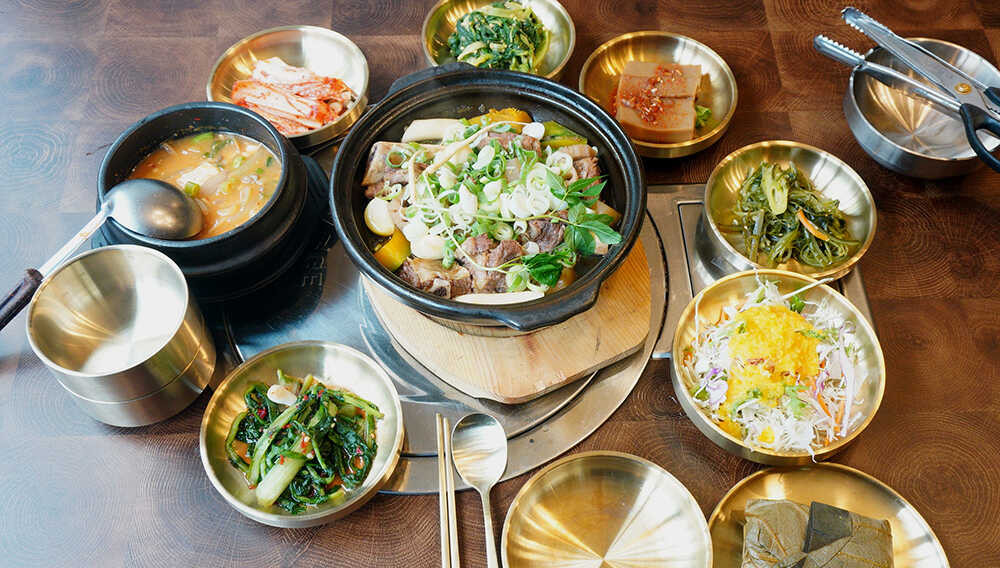
Where is `empty bowl`? The image size is (1000, 568). empty bowl is located at coordinates (178, 321), (177, 387).